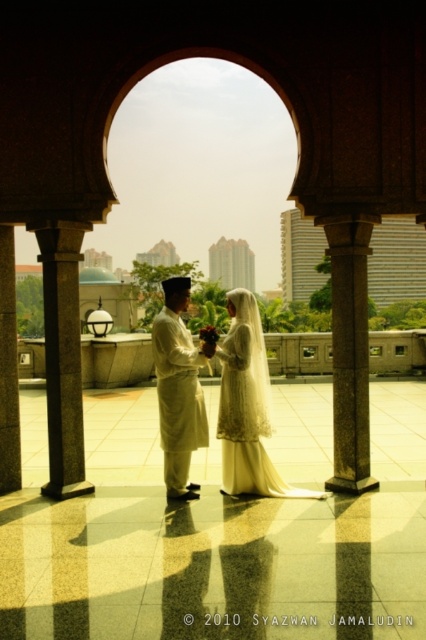
You are a photographer positioned at the entrance of the archway. You want to take a photo of the granite column at left and the smooth stone pillar at left. Which one will appear closer to you in the photo?

The granite column at left will appear closer to you in the photo because it is positioned in front of the smooth stone pillar at left.

You are a photographer positioned to capture the wedding scene. The couple is standing under the archway, and you need to ensure the white lace dress at center is in the frame. Based on its position, will the dress be visible in the photo if you aim the camera directly at the center of the archway?

The white lace dress at center is located at point (x=247, y=420), which is slightly offset from the exact center of the archway. Therefore, aiming the camera directly at the center of the archway may not fully capture the dress in the frame. Adjust the camera angle slightly to ensure the dress is centered.

You are a photographer positioned at the entrance of the archway. You want to take a photo of the beige cotton kurta at center and the smooth stone pillar at left. Which object will appear larger in the photo?

The beige cotton kurta at center will appear larger in the photo because it is closer to the viewer than the smooth stone pillar at left.